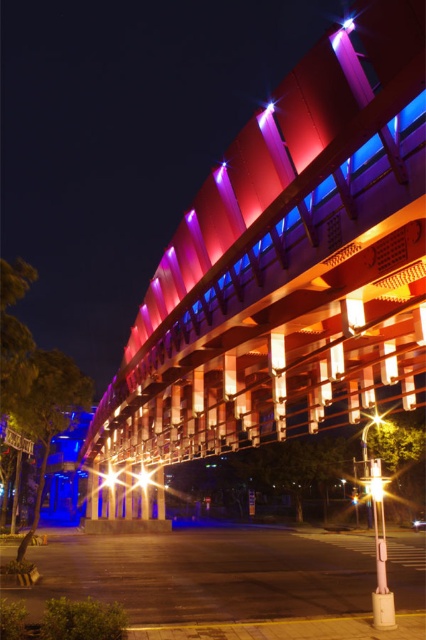
Question: Does bright metallic streetlight at center appear on the right side of bright metallic light at center?

Choices:
 (A) yes
 (B) no

Answer: (A)

Question: Among these objects, which one is nearest to the camera?

Choices:
 (A) bright metallic light at center
 (B) bright metallic streetlight at center

Answer: (A)

Question: Is bright metallic streetlight at center wider than bright metallic light at center?

Choices:
 (A) no
 (B) yes

Answer: (B)

Question: Does bright metallic streetlight at center appear over bright metallic light at center?

Choices:
 (A) no
 (B) yes

Answer: (A)